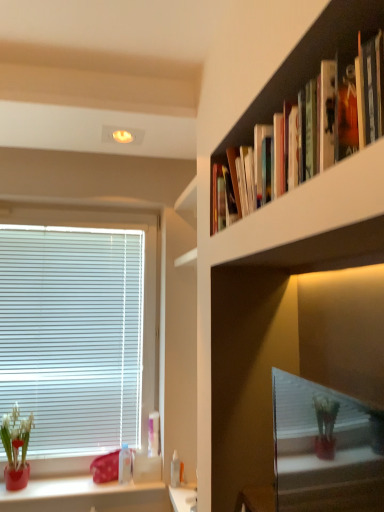
Measure the distance between point (130, 467) and camera.

The depth of point (130, 467) is 2.20 meters.

What do you see at coordinates (175, 470) in the screenshot? I see `transparent plastic bottle at lower center, positioned as the 2th toiletry in right-to-left order` at bounding box center [175, 470].

This screenshot has width=384, height=512. What are the coordinates of `matte red vase at lower left` in the screenshot? It's located at (16, 436).

Describe the element at coordinates (16, 436) in the screenshot. I see `matte red vase at lower left` at that location.

Locate an element on the screen. This screenshot has width=384, height=512. transparent plastic bottle at lower left, which ranks as the third toiletry in right-to-left order is located at coordinates (125, 464).

How different are the orientations of white glossy vanity at lower center and transparent plastic bottle at lower center, positioned as the 2th toiletry in right-to-left order, in degrees?

2.18 degrees.

Considering the sizes of objects white glossy vanity at lower center and transparent plastic bottle at lower center, positioned as the 2th toiletry in right-to-left order, in the image provided, who is thinner, white glossy vanity at lower center or transparent plastic bottle at lower center, positioned as the 2th toiletry in right-to-left order,?

transparent plastic bottle at lower center, positioned as the 2th toiletry in right-to-left order, is thinner.

Do you think white glossy vanity at lower center is within transparent plastic bottle at lower center, positioned as the 2th toiletry in right-to-left order, or outside of it?

white glossy vanity at lower center is not inside transparent plastic bottle at lower center, positioned as the 2th toiletry in right-to-left order, it's outside.

Is white glossy vanity at lower center further to camera compared to transparent plastic bottle at lower center, positioned as the 2th toiletry in right-to-left order?

No, it is not.

Can you confirm if white blinds at left is smaller than white plastic bottle at lower center, placed as the third toiletry when sorted from left to right?

No.

Is white blinds at left not inside white plastic bottle at lower center, marked as the first toiletry in a right-to-left arrangement?

Yes, white blinds at left is outside of white plastic bottle at lower center, marked as the first toiletry in a right-to-left arrangement.

You are a GUI agent. You are given a task and a screenshot of the screen. Output one action in this format:
    pyautogui.click(x=<x>, y=<y>)
    Task: Click on the window located in front of the white plastic bottle at lower center, marked as the first toiletry in a right-to-left arrangement
    The height and width of the screenshot is (512, 384).
    Given the screenshot: What is the action you would take?
    pyautogui.click(x=78, y=328)

Which of these two, white blinds at left or white plastic bottle at lower center, placed as the third toiletry when sorted from left to right, is wider?

white blinds at left is wider.

From a real-world perspective, is white glossy vanity at lower center below white blinds at left?

Yes.

Does white glossy vanity at lower center contain white blinds at left?

No, white glossy vanity at lower center does not contain white blinds at left.

Looking at the image, does white glossy vanity at lower center seem bigger or smaller compared to white blinds at left?

In the image, white glossy vanity at lower center appears to be smaller than white blinds at left.

Is white glossy vanity at lower center turned away from white blinds at left?

That's not correct — white glossy vanity at lower center is not looking away from white blinds at left.

Can you confirm if white plastic bottle at lower center, marked as the first toiletry in a right-to-left arrangement, is wider than transparent plastic bottle at lower left, arranged as the 1th toiletry when viewed from the left?

Incorrect, the width of white plastic bottle at lower center, marked as the first toiletry in a right-to-left arrangement, does not surpass that of transparent plastic bottle at lower left, arranged as the 1th toiletry when viewed from the left.

Would you say white plastic bottle at lower center, marked as the first toiletry in a right-to-left arrangement, is to the left or to the right of transparent plastic bottle at lower left, which ranks as the third toiletry in right-to-left order, in the picture?

From the image, it's evident that white plastic bottle at lower center, marked as the first toiletry in a right-to-left arrangement, is to the right of transparent plastic bottle at lower left, which ranks as the third toiletry in right-to-left order.

From a real-world perspective, is white plastic bottle at lower center, placed as the third toiletry when sorted from left to right, located beneath transparent plastic bottle at lower left, which ranks as the third toiletry in right-to-left order?

Correct, in the physical world, white plastic bottle at lower center, placed as the third toiletry when sorted from left to right, is lower than transparent plastic bottle at lower left, which ranks as the third toiletry in right-to-left order.

Is white plastic bottle at lower center, marked as the first toiletry in a right-to-left arrangement, positioned far away from transparent plastic bottle at lower left, which ranks as the third toiletry in right-to-left order?

That's not correct — white plastic bottle at lower center, marked as the first toiletry in a right-to-left arrangement, is a little close to transparent plastic bottle at lower left, which ranks as the third toiletry in right-to-left order.

Is point (176, 461) closer to viewer compared to point (118, 479)?

Yes, it is in front of point (118, 479).

Is the position of transparent plastic bottle at lower center, positioned as the 2th toiletry in right-to-left order, less distant than that of transparent plastic bottle at lower left, which ranks as the third toiletry in right-to-left order?

Yes, it is in front of transparent plastic bottle at lower left, which ranks as the third toiletry in right-to-left order.

Between transparent plastic bottle at lower center, positioned as the 2th toiletry in right-to-left order, and transparent plastic bottle at lower left, which ranks as the third toiletry in right-to-left order, which one has smaller width?

transparent plastic bottle at lower center, positioned as the 2th toiletry in right-to-left order, is thinner.

Is transparent plastic bottle at lower center, which ranks as the 2th toiletry in left-to-right order, far away from transparent plastic bottle at lower left, arranged as the 1th toiletry when viewed from the left?

No.

Which of these two, white blinds at left or transparent plastic bottle at lower left, arranged as the 1th toiletry when viewed from the left, is smaller?

transparent plastic bottle at lower left, arranged as the 1th toiletry when viewed from the left.

Identify the location of window above the transparent plastic bottle at lower left, arranged as the 1th toiletry when viewed from the left (from a real-world perspective). (78, 328).

Can you confirm if white blinds at left is shorter than transparent plastic bottle at lower left, arranged as the 1th toiletry when viewed from the left?

Incorrect, the height of white blinds at left does not fall short of that of transparent plastic bottle at lower left, arranged as the 1th toiletry when viewed from the left.

From a real-world perspective, is white blinds at left positioned above or below transparent plastic bottle at lower left, which ranks as the third toiletry in right-to-left order?

white blinds at left is situated higher than transparent plastic bottle at lower left, which ranks as the third toiletry in right-to-left order, in the real world.

Is white glossy vanity at lower center further to camera compared to white plastic bottle at lower center, marked as the first toiletry in a right-to-left arrangement?

No, white glossy vanity at lower center is in front of white plastic bottle at lower center, marked as the first toiletry in a right-to-left arrangement.

Considering the sizes of objects white glossy vanity at lower center and white plastic bottle at lower center, placed as the third toiletry when sorted from left to right, in the image provided, who is smaller, white glossy vanity at lower center or white plastic bottle at lower center, placed as the third toiletry when sorted from left to right,?

With smaller size is white plastic bottle at lower center, placed as the third toiletry when sorted from left to right.

Considering the relative positions of white glossy vanity at lower center and white plastic bottle at lower center, placed as the third toiletry when sorted from left to right, in the image provided, is white glossy vanity at lower center to the left or to the right of white plastic bottle at lower center, placed as the third toiletry when sorted from left to right,?

From the image, it's evident that white glossy vanity at lower center is to the right of white plastic bottle at lower center, placed as the third toiletry when sorted from left to right.

Locate an element on the screen. This screenshot has height=512, width=384. the 1st toiletry behind when counting from the white glossy vanity at lower center is located at coordinates (175, 470).

At what (x,y) coordinates should I click in order to perform the action: click on the 3rd toiletry below when counting from the white blinds at left (from the image's perspective). Please return your answer as a coordinate pair (x, y). Looking at the image, I should click on (182, 473).

Which object lies further to the anchor point matte red vase at lower left, white glossy vanity at lower center or white plastic bottle at lower center, marked as the first toiletry in a right-to-left arrangement?

white plastic bottle at lower center, marked as the first toiletry in a right-to-left arrangement, is further to matte red vase at lower left.

Based on their spatial positions, is transparent plastic bottle at lower left, which ranks as the third toiletry in right-to-left order, or white blinds at left further from transparent plastic bottle at lower center, positioned as the 2th toiletry in right-to-left order?

The object further to transparent plastic bottle at lower center, positioned as the 2th toiletry in right-to-left order, is white blinds at left.

From the picture: Considering their positions, is hardcover books at upper right positioned closer to transparent plastic bottle at lower center, which ranks as the 2th toiletry in left-to-right order, than matte red vase at lower left?

matte red vase at lower left is positioned closer to the anchor transparent plastic bottle at lower center, which ranks as the 2th toiletry in left-to-right order.

When comparing their distances from white plastic bottle at lower center, placed as the third toiletry when sorted from left to right, does matte red vase at lower left or white blinds at left seem further?

white blinds at left lies further to white plastic bottle at lower center, placed as the third toiletry when sorted from left to right, than the other object.

From the picture: Which object lies further to the anchor point transparent plastic bottle at lower left, which ranks as the third toiletry in right-to-left order, white blinds at left or transparent plastic bottle at lower center, positioned as the 2th toiletry in right-to-left order?

Among the two, white blinds at left is located further to transparent plastic bottle at lower left, which ranks as the third toiletry in right-to-left order.

From the image, which object appears to be nearer to matte ceramic pot at lower left, matte red vase at lower left or white plastic bottle at lower center, marked as the first toiletry in a right-to-left arrangement?

The object closer to matte ceramic pot at lower left is matte red vase at lower left.

Based on their spatial positions, is transparent plastic bottle at lower center, which ranks as the 2th toiletry in left-to-right order, or white glossy vanity at lower center closer to transparent plastic bottle at lower left, arranged as the 1th toiletry when viewed from the left?

The object closer to transparent plastic bottle at lower left, arranged as the 1th toiletry when viewed from the left, is transparent plastic bottle at lower center, which ranks as the 2th toiletry in left-to-right order.

Considering their positions, is hardcover books at upper right positioned further to white blinds at left than white plastic bottle at lower center, placed as the third toiletry when sorted from left to right?

The object further to white blinds at left is hardcover books at upper right.

Find the location of a particular element. The image size is (384, 512). cabinetry between matte red vase at lower left and white plastic bottle at lower center, marked as the first toiletry in a right-to-left arrangement, in the horizontal direction is located at coordinates (85, 496).

What are the coordinates of `floral arrangement between hardcover books at upper right and white plastic bottle at lower center, marked as the first toiletry in a right-to-left arrangement, from front to back` in the screenshot? It's located at (16, 436).

What are the coordinates of `cabinetry between matte red vase at lower left and transparent plastic bottle at lower left, arranged as the 1th toiletry when viewed from the left, in the horizontal direction` in the screenshot? It's located at (85, 496).

Find the location of a particular element. floral arrangement located between hardcover books at upper right and transparent plastic bottle at lower left, which ranks as the third toiletry in right-to-left order, in the depth direction is located at coordinates (16, 436).